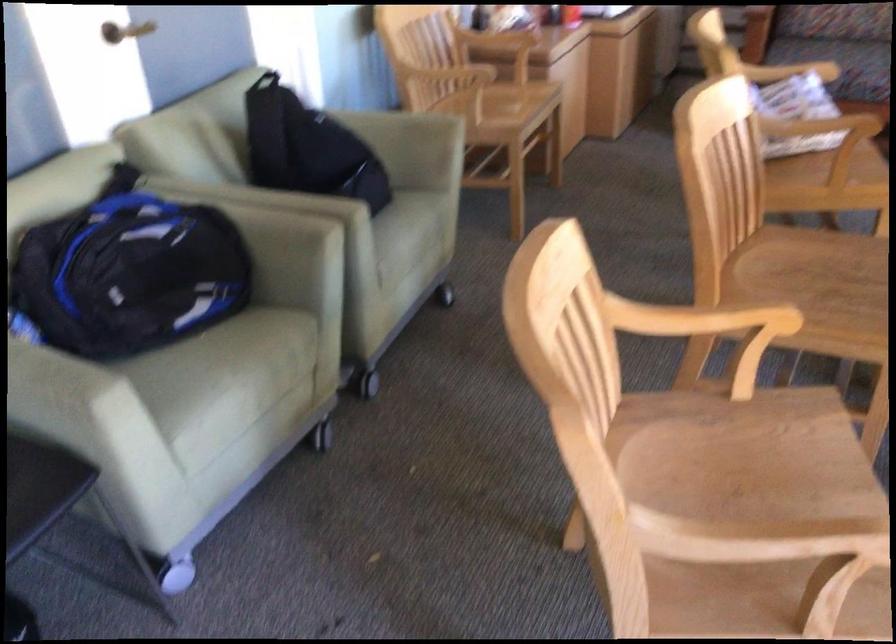
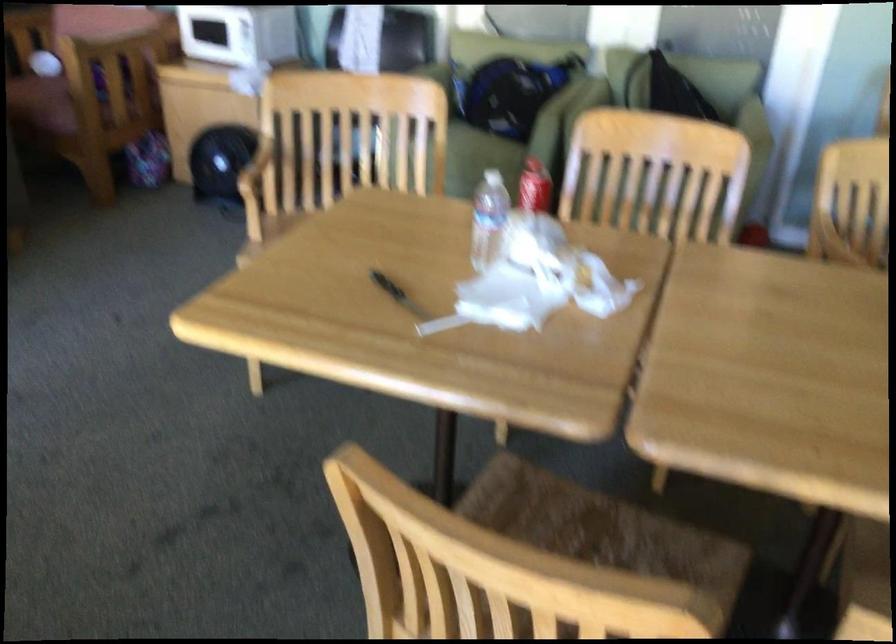
Question: I am providing you with two images of the same scene from different viewpoints. After the viewpoint changes to image2, which objects are now occluded?

Choices:
 (A) sofa sitting surface
 (B) sofa armrest
 (C) chair armrest
 (D) tan heeled sandal

Answer: (B)